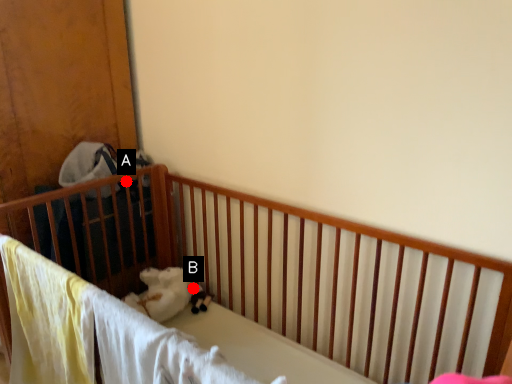
Question: Two points are circled on the image, labeled by A and B beside each circle. Among these points, which one is nearest to the camera?

Choices:
 (A) A is closer
 (B) B is closer

Answer: (A)